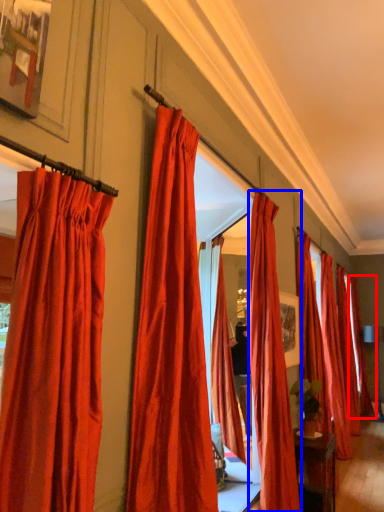
Question: Which object is further to the camera taking this photo, curtain (highlighted by a red box) or curtain (highlighted by a blue box)?

Choices:
 (A) curtain
 (B) curtain

Answer: (A)